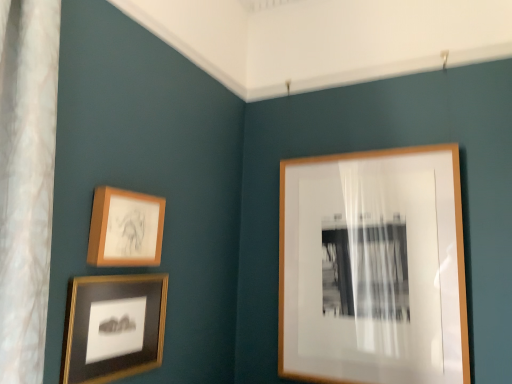
Question: Is wooden frame at upper right, which is the 1th picture frame from right to left, to the left of matte black frame at lower left, the 3th picture frame when ordered from right to left, from the viewer's perspective?

Choices:
 (A) yes
 (B) no

Answer: (B)

Question: From the image's perspective, is wooden frame at upper right, the 3th picture frame positioned from the left, below matte black frame at lower left, arranged as the first picture frame when viewed from the left?

Choices:
 (A) yes
 (B) no

Answer: (B)

Question: Is wooden frame at upper right, the 3th picture frame positioned from the left, wider than matte black frame at lower left, arranged as the first picture frame when viewed from the left?

Choices:
 (A) yes
 (B) no

Answer: (A)

Question: From the image's perspective, is wooden frame at upper right, which is the 1th picture frame from right to left, on matte black frame at lower left, the 3th picture frame when ordered from right to left?

Choices:
 (A) no
 (B) yes

Answer: (B)

Question: Does wooden frame at upper right, the 3th picture frame positioned from the left, lie behind matte black frame at lower left, the 3th picture frame when ordered from right to left?

Choices:
 (A) yes
 (B) no

Answer: (A)

Question: From a real-world perspective, is wooden frame at upper right, the 3th picture frame positioned from the left, physically above matte black frame at lower left, arranged as the first picture frame when viewed from the left?

Choices:
 (A) yes
 (B) no

Answer: (A)

Question: From a real-world perspective, is matte wooden picture frame at upper left, which appears as the second picture frame when viewed from the right, on top of matte black frame at lower left, arranged as the first picture frame when viewed from the left?

Choices:
 (A) yes
 (B) no

Answer: (A)

Question: Is matte wooden picture frame at upper left, which appears as the second picture frame when viewed from the right, smaller than matte black frame at lower left, the 3th picture frame when ordered from right to left?

Choices:
 (A) yes
 (B) no

Answer: (A)

Question: Is matte wooden picture frame at upper left, which appears as the second picture frame when viewed from the right, taller than matte black frame at lower left, the 3th picture frame when ordered from right to left?

Choices:
 (A) yes
 (B) no

Answer: (B)

Question: Does matte wooden picture frame at upper left, which appears as the second picture frame when viewed from the right, have a larger size compared to matte black frame at lower left, the 3th picture frame when ordered from right to left?

Choices:
 (A) no
 (B) yes

Answer: (A)

Question: Is matte wooden picture frame at upper left, which ranks as the second picture frame in left-to-right order, outside of matte black frame at lower left, arranged as the first picture frame when viewed from the left?

Choices:
 (A) yes
 (B) no

Answer: (A)

Question: Is matte wooden picture frame at upper left, which appears as the second picture frame when viewed from the right, facing towards matte black frame at lower left, arranged as the first picture frame when viewed from the left?

Choices:
 (A) no
 (B) yes

Answer: (A)

Question: From the image's perspective, is matte black frame at lower left, arranged as the first picture frame when viewed from the left, on matte wooden picture frame at upper left, which appears as the second picture frame when viewed from the right?

Choices:
 (A) no
 (B) yes

Answer: (A)